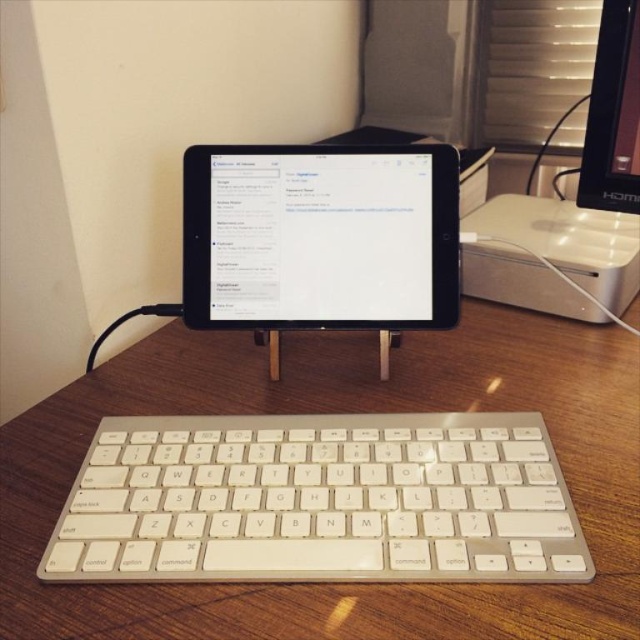
Question: Where is black glossy tablet at center located in relation to black glossy monitor at upper right in the image?

Choices:
 (A) left
 (B) right

Answer: (A)

Question: Which is farther from the white plastic keyboard at center?

Choices:
 (A) wooden table at center
 (B) black glossy monitor at upper right
 (C) white plastic desktop computer at upper right
 (D) black glossy tablet at center

Answer: (B)

Question: Is white plastic desktop computer at upper right in front of black glossy monitor at upper right?

Choices:
 (A) no
 (B) yes

Answer: (B)

Question: Among these points, which one is farthest from the camera?

Choices:
 (A) (369, 484)
 (B) (253, 205)
 (C) (616, 84)
 (D) (611, 147)

Answer: (D)

Question: Is white plastic keyboard at center in front of white plastic desktop computer at upper right?

Choices:
 (A) no
 (B) yes

Answer: (B)

Question: Which point is farther to the camera?

Choices:
 (A) black glossy monitor at upper right
 (B) white plastic desktop computer at upper right
 (C) white plastic keyboard at center
 (D) wooden table at center

Answer: (A)